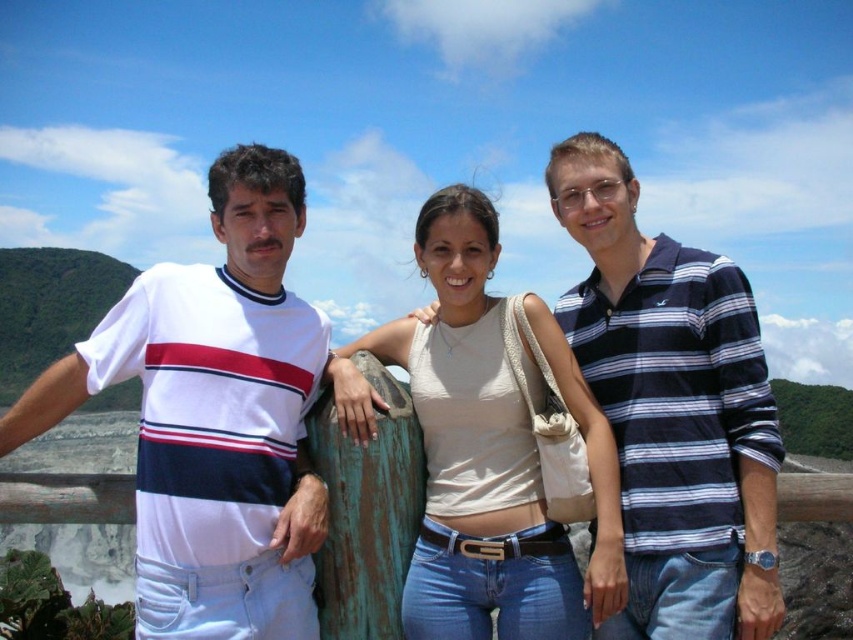
You are a photographer trying to capture a group photo of the blue striped polo shirt at right and the beige fabric tank top at center. Since you want to ensure both subjects are in focus, you need to know their heights. Which person is taller?

The blue striped polo shirt at right is much taller than the beige fabric tank top at center, so the photographer should adjust the camera angle to account for the height difference to ensure both are in focus.

You are standing at the scenic overlook and see a point marked at coordinates (672, 408). Which object from the following list is this point located on? Choose from the options below. The options are blue striped polo shirt at right, weathered wooden railing, or light colored jeans.

The point at (672, 408) is located on the blue striped polo shirt at right.